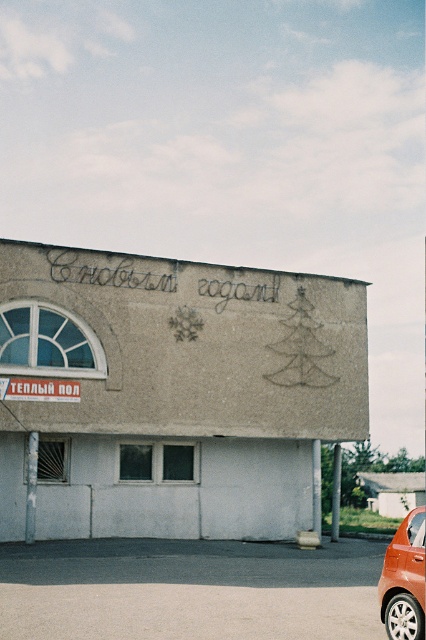
Does orange matte car at lower right have a lesser height compared to white plastic sign at upper left?

No, orange matte car at lower right is not shorter than white plastic sign at upper left.

Can you confirm if orange matte car at lower right is positioned to the left of white plastic sign at upper left?

Incorrect, orange matte car at lower right is not on the left side of white plastic sign at upper left.

Which is in front, point (416, 516) or point (36, 394)?

Point (416, 516)

At what (x,y) coordinates should I click in order to perform the action: click on orange matte car at lower right. Please return your answer as a coordinate pair (x, y). The width and height of the screenshot is (426, 640). Looking at the image, I should click on (403, 579).